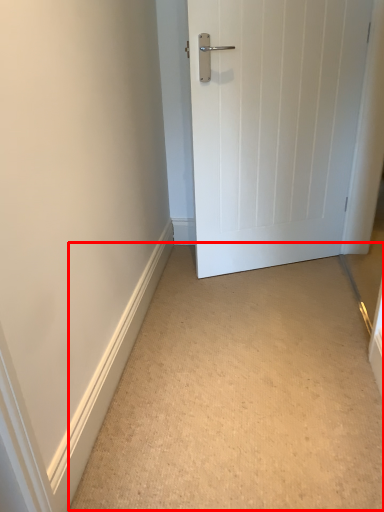
Question: Observing the image, what is the correct spatial positioning of corridor (annotated by the red box) in reference to door?

Choices:
 (A) left
 (B) right

Answer: (A)